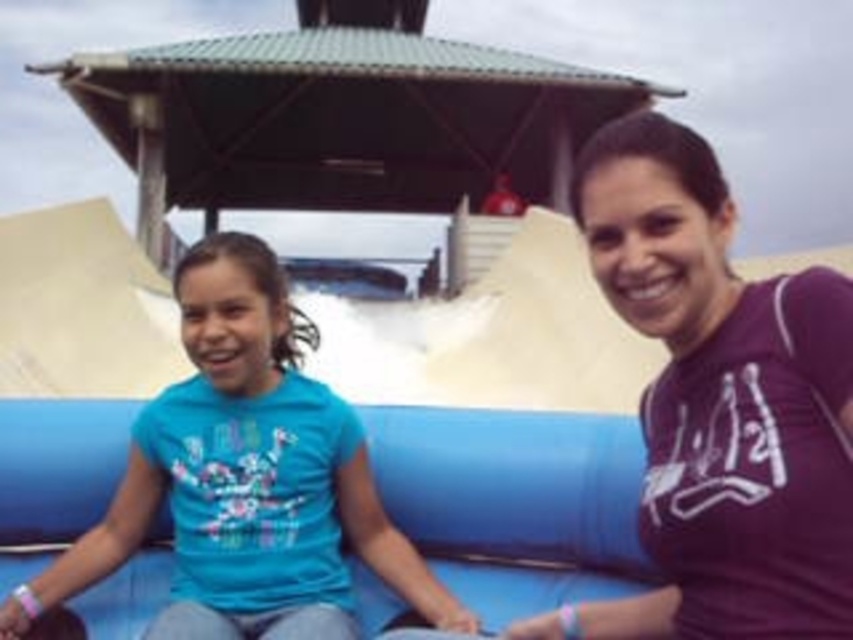
Who is higher up, purple matte shirt at center or blue fabric shirt at center?

purple matte shirt at center

The width and height of the screenshot is (853, 640). In order to click on purple matte shirt at center in this screenshot , I will do `click(718, 404)`.